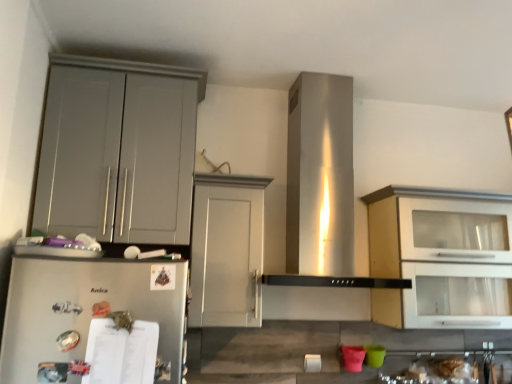
Consider the image. How much space does white glossy cabinet at upper right, marked as the 1th cabinetry in a right-to-left arrangement, occupy vertically?

white glossy cabinet at upper right, marked as the 1th cabinetry in a right-to-left arrangement, is 26.64 inches in height.

The image size is (512, 384). I want to click on white glossy cabinet at upper right, which appears as the third cabinetry when viewed from the left, so click(435, 254).

At what (x,y) coordinates should I click in order to perform the action: click on satin silver refrigerator at lower left. Please return your answer as a coordinate pair (x, y). Looking at the image, I should click on (83, 309).

Is white glossy cabinet at upper right, marked as the 1th cabinetry in a right-to-left arrangement, in front of or behind matte gray cabinet at left, arranged as the 3th cabinetry when viewed from the right, in the image?

white glossy cabinet at upper right, marked as the 1th cabinetry in a right-to-left arrangement, is behind matte gray cabinet at left, arranged as the 3th cabinetry when viewed from the right.

Based on the photo, is white glossy cabinet at upper right, marked as the 1th cabinetry in a right-to-left arrangement, not close to matte gray cabinet at left, which ranks as the first cabinetry in left-to-right order?

Indeed, white glossy cabinet at upper right, marked as the 1th cabinetry in a right-to-left arrangement, is not near matte gray cabinet at left, which ranks as the first cabinetry in left-to-right order.

Is point (403, 269) less distant than point (150, 129)?

No, it is behind (150, 129).

Looking at this image, considering the relative positions of white glossy cabinet at upper right, marked as the 1th cabinetry in a right-to-left arrangement, and matte gray cabinet at left, arranged as the 3th cabinetry when viewed from the right, in the image provided, is white glossy cabinet at upper right, marked as the 1th cabinetry in a right-to-left arrangement, to the left of matte gray cabinet at left, arranged as the 3th cabinetry when viewed from the right, from the viewer's perspective?

In fact, white glossy cabinet at upper right, marked as the 1th cabinetry in a right-to-left arrangement, is to the right of matte gray cabinet at left, arranged as the 3th cabinetry when viewed from the right.

From the image's perspective, does white matte cabinet at center, the second cabinetry in the right-to-left sequence, appear higher than white glossy cabinet at upper right, marked as the 1th cabinetry in a right-to-left arrangement?

Yes, from the image's perspective, white matte cabinet at center, the second cabinetry in the right-to-left sequence, is over white glossy cabinet at upper right, marked as the 1th cabinetry in a right-to-left arrangement.

Is white matte cabinet at center, marked as the second cabinetry in a left-to-right arrangement, not close to white glossy cabinet at upper right, which appears as the third cabinetry when viewed from the left?

white matte cabinet at center, marked as the second cabinetry in a left-to-right arrangement, is near white glossy cabinet at upper right, which appears as the third cabinetry when viewed from the left, not far away.

Who is smaller, white matte cabinet at center, marked as the second cabinetry in a left-to-right arrangement, or white glossy cabinet at upper right, which appears as the third cabinetry when viewed from the left?

white matte cabinet at center, marked as the second cabinetry in a left-to-right arrangement.

From a real-world perspective, count 1st cabinetrys upward from the white matte cabinet at center, marked as the second cabinetry in a left-to-right arrangement, and point to it. Please provide its 2D coordinates.

[(435, 254)]

Is the depth of matte gray cabinet at left, which ranks as the first cabinetry in left-to-right order, less than that of satin silver refrigerator at lower left?

No, matte gray cabinet at left, which ranks as the first cabinetry in left-to-right order, is behind satin silver refrigerator at lower left.

From a real-world perspective, is matte gray cabinet at left, which ranks as the first cabinetry in left-to-right order, beneath satin silver refrigerator at lower left?

No, from a real-world perspective, matte gray cabinet at left, which ranks as the first cabinetry in left-to-right order, is not beneath satin silver refrigerator at lower left.

Could you tell me if matte gray cabinet at left, which ranks as the first cabinetry in left-to-right order, is turned towards satin silver refrigerator at lower left?

No, matte gray cabinet at left, which ranks as the first cabinetry in left-to-right order, is not turned towards satin silver refrigerator at lower left.

From the image's perspective, is matte gray cabinet at left, arranged as the 3th cabinetry when viewed from the right, located above satin silver refrigerator at lower left?

Yes, from the image's perspective, matte gray cabinet at left, arranged as the 3th cabinetry when viewed from the right, is on top of satin silver refrigerator at lower left.

From the image's perspective, between matte gray cabinet at left, arranged as the 3th cabinetry when viewed from the right, and white glossy cabinet at upper right, marked as the 1th cabinetry in a right-to-left arrangement, who is located below?

From the image's view, white glossy cabinet at upper right, marked as the 1th cabinetry in a right-to-left arrangement, is below.

Is white glossy cabinet at upper right, which appears as the third cabinetry when viewed from the left, completely or partially inside matte gray cabinet at left, which ranks as the first cabinetry in left-to-right order?

No, matte gray cabinet at left, which ranks as the first cabinetry in left-to-right order, does not contain white glossy cabinet at upper right, which appears as the third cabinetry when viewed from the left.

What's the angular difference between matte gray cabinet at left, arranged as the 3th cabinetry when viewed from the right, and white glossy cabinet at upper right, marked as the 1th cabinetry in a right-to-left arrangement,'s facing directions?

There is a 0.000455-degree angle between the facing directions of matte gray cabinet at left, arranged as the 3th cabinetry when viewed from the right, and white glossy cabinet at upper right, marked as the 1th cabinetry in a right-to-left arrangement.

Measure the distance from matte gray cabinet at left, which ranks as the first cabinetry in left-to-right order, to white glossy cabinet at upper right, marked as the 1th cabinetry in a right-to-left arrangement.

They are 1.18 meters apart.

I want to click on refrigerator on the right of matte gray cabinet at left, arranged as the 3th cabinetry when viewed from the right, so click(83, 309).

Is the position of satin silver refrigerator at lower left less distant than that of matte gray cabinet at left, which ranks as the first cabinetry in left-to-right order?

Yes, satin silver refrigerator at lower left is in front of matte gray cabinet at left, which ranks as the first cabinetry in left-to-right order.

Does satin silver refrigerator at lower left have a greater height compared to matte gray cabinet at left, arranged as the 3th cabinetry when viewed from the right?

No, satin silver refrigerator at lower left is not taller than matte gray cabinet at left, arranged as the 3th cabinetry when viewed from the right.

Does satin silver refrigerator at lower left have a larger size compared to matte gray cabinet at left, which ranks as the first cabinetry in left-to-right order?

No, satin silver refrigerator at lower left is not bigger than matte gray cabinet at left, which ranks as the first cabinetry in left-to-right order.

From the picture: Does white glossy cabinet at upper right, marked as the 1th cabinetry in a right-to-left arrangement, have a larger size compared to white matte cabinet at center, marked as the second cabinetry in a left-to-right arrangement?

Correct, white glossy cabinet at upper right, marked as the 1th cabinetry in a right-to-left arrangement, is larger in size than white matte cabinet at center, marked as the second cabinetry in a left-to-right arrangement.

Is white matte cabinet at center, the second cabinetry in the right-to-left sequence, at the back of white glossy cabinet at upper right, marked as the 1th cabinetry in a right-to-left arrangement?

No, white glossy cabinet at upper right, marked as the 1th cabinetry in a right-to-left arrangement, is not facing the opposite direction of white matte cabinet at center, the second cabinetry in the right-to-left sequence.

Considering the relative positions of white glossy cabinet at upper right, marked as the 1th cabinetry in a right-to-left arrangement, and white matte cabinet at center, the second cabinetry in the right-to-left sequence, in the image provided, is white glossy cabinet at upper right, marked as the 1th cabinetry in a right-to-left arrangement, behind white matte cabinet at center, the second cabinetry in the right-to-left sequence,?

Yes, it is behind white matte cabinet at center, the second cabinetry in the right-to-left sequence.

Looking at this image, measure the distance between matte gray cabinet at left, arranged as the 3th cabinetry when viewed from the right, and white matte cabinet at center, the second cabinetry in the right-to-left sequence.

matte gray cabinet at left, arranged as the 3th cabinetry when viewed from the right, and white matte cabinet at center, the second cabinetry in the right-to-left sequence, are 11.97 inches apart.

Is matte gray cabinet at left, arranged as the 3th cabinetry when viewed from the right, taller than white matte cabinet at center, marked as the second cabinetry in a left-to-right arrangement?

Yes.

Would you consider matte gray cabinet at left, which ranks as the first cabinetry in left-to-right order, to be distant from white matte cabinet at center, the second cabinetry in the right-to-left sequence?

No.

Is matte gray cabinet at left, which ranks as the first cabinetry in left-to-right order, inside or outside of white matte cabinet at center, the second cabinetry in the right-to-left sequence?

matte gray cabinet at left, which ranks as the first cabinetry in left-to-right order, is spatially situated outside white matte cabinet at center, the second cabinetry in the right-to-left sequence.

Image resolution: width=512 pixels, height=384 pixels. What are the coordinates of `cabinetry that is the 2nd one when counting rightward from the matte gray cabinet at left, arranged as the 3th cabinetry when viewed from the right` in the screenshot? It's located at (435, 254).

Starting from the white glossy cabinet at upper right, which appears as the third cabinetry when viewed from the left, which cabinetry is the 1st one in front? Please provide its 2D coordinates.

[(227, 250)]

Which object lies further to the anchor point matte gray cabinet at left, which ranks as the first cabinetry in left-to-right order, white matte cabinet at center, the second cabinetry in the right-to-left sequence, or white glossy cabinet at upper right, marked as the 1th cabinetry in a right-to-left arrangement?

white glossy cabinet at upper right, marked as the 1th cabinetry in a right-to-left arrangement, is positioned further to the anchor matte gray cabinet at left, which ranks as the first cabinetry in left-to-right order.

Estimate the real-world distances between objects in this image. Which object is closer to white matte cabinet at center, the second cabinetry in the right-to-left sequence, white glossy cabinet at upper right, marked as the 1th cabinetry in a right-to-left arrangement, or satin silver refrigerator at lower left?

Among the two, satin silver refrigerator at lower left is located nearer to white matte cabinet at center, the second cabinetry in the right-to-left sequence.

From the image, which object appears to be farther from white matte cabinet at center, marked as the second cabinetry in a left-to-right arrangement, satin silver refrigerator at lower left or matte gray cabinet at left, arranged as the 3th cabinetry when viewed from the right?

The object further to white matte cabinet at center, marked as the second cabinetry in a left-to-right arrangement, is satin silver refrigerator at lower left.

Based on their spatial positions, is matte gray cabinet at left, arranged as the 3th cabinetry when viewed from the right, or white glossy cabinet at upper right, marked as the 1th cabinetry in a right-to-left arrangement, closer to white matte cabinet at center, the second cabinetry in the right-to-left sequence?

matte gray cabinet at left, arranged as the 3th cabinetry when viewed from the right.

Based on the photo, based on their spatial positions, is satin silver refrigerator at lower left or white matte cabinet at center, marked as the second cabinetry in a left-to-right arrangement, further from white glossy cabinet at upper right, marked as the 1th cabinetry in a right-to-left arrangement?

satin silver refrigerator at lower left lies further to white glossy cabinet at upper right, marked as the 1th cabinetry in a right-to-left arrangement, than the other object.

Based on their spatial positions, is white matte cabinet at center, marked as the second cabinetry in a left-to-right arrangement, or satin silver refrigerator at lower left further from white glossy cabinet at upper right, marked as the 1th cabinetry in a right-to-left arrangement?

Among the two, satin silver refrigerator at lower left is located further to white glossy cabinet at upper right, marked as the 1th cabinetry in a right-to-left arrangement.

Consider the image. Based on their spatial positions, is white glossy cabinet at upper right, which appears as the third cabinetry when viewed from the left, or white matte cabinet at center, the second cabinetry in the right-to-left sequence, closer to matte gray cabinet at left, which ranks as the first cabinetry in left-to-right order?

white matte cabinet at center, the second cabinetry in the right-to-left sequence, lies closer to matte gray cabinet at left, which ranks as the first cabinetry in left-to-right order, than the other object.

Estimate the real-world distances between objects in this image. Which object is closer to white matte cabinet at center, the second cabinetry in the right-to-left sequence, satin silver refrigerator at lower left or white glossy cabinet at upper right, which appears as the third cabinetry when viewed from the left?

Based on the image, satin silver refrigerator at lower left appears to be nearer to white matte cabinet at center, the second cabinetry in the right-to-left sequence.

What are the coordinates of `refrigerator situated between matte gray cabinet at left, which ranks as the first cabinetry in left-to-right order, and white glossy cabinet at upper right, marked as the 1th cabinetry in a right-to-left arrangement, from left to right` in the screenshot? It's located at (83, 309).

Where is `cabinetry between satin silver refrigerator at lower left and white glossy cabinet at upper right, marked as the 1th cabinetry in a right-to-left arrangement, in the horizontal direction`? The width and height of the screenshot is (512, 384). cabinetry between satin silver refrigerator at lower left and white glossy cabinet at upper right, marked as the 1th cabinetry in a right-to-left arrangement, in the horizontal direction is located at coordinates (227, 250).

Locate an element on the screen. cabinetry between matte gray cabinet at left, which ranks as the first cabinetry in left-to-right order, and white glossy cabinet at upper right, marked as the 1th cabinetry in a right-to-left arrangement is located at coordinates [227, 250].